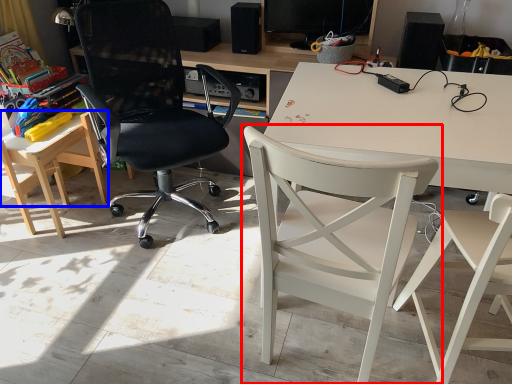
Question: Which point is closer to the camera, chair (highlighted by a red box) or table (highlighted by a blue box)?

Choices:
 (A) chair
 (B) table

Answer: (A)